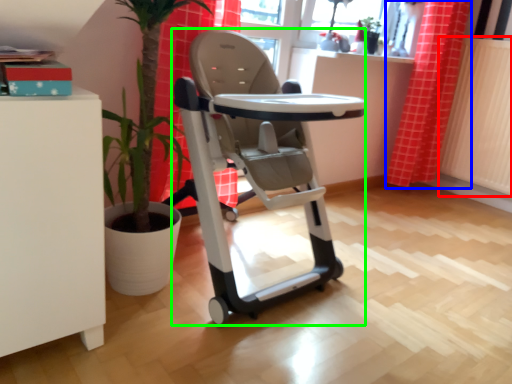
Question: Considering the real-world distances, which object is closest to radiator (highlighted by a red box)? curtain (highlighted by a blue box) or baby carriage (highlighted by a green box).

Choices:
 (A) curtain
 (B) baby carriage

Answer: (A)